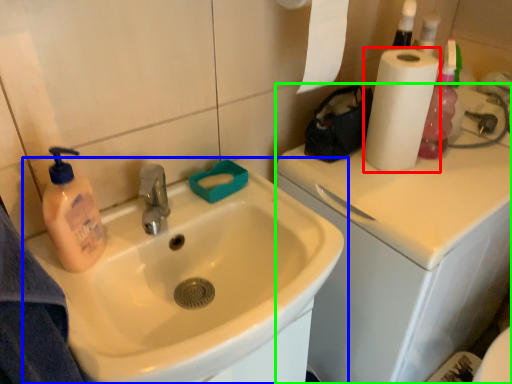
Question: Which object is the closest to the paper towel (highlighted by a red box)? Choose among these: sink (highlighted by a blue box) or counter top (highlighted by a green box).

Choices:
 (A) sink
 (B) counter top

Answer: (B)